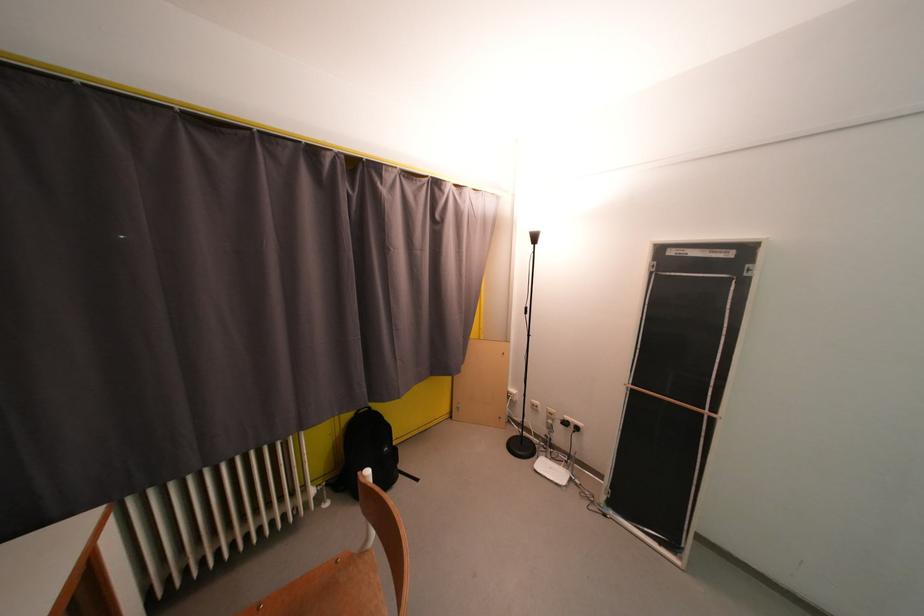
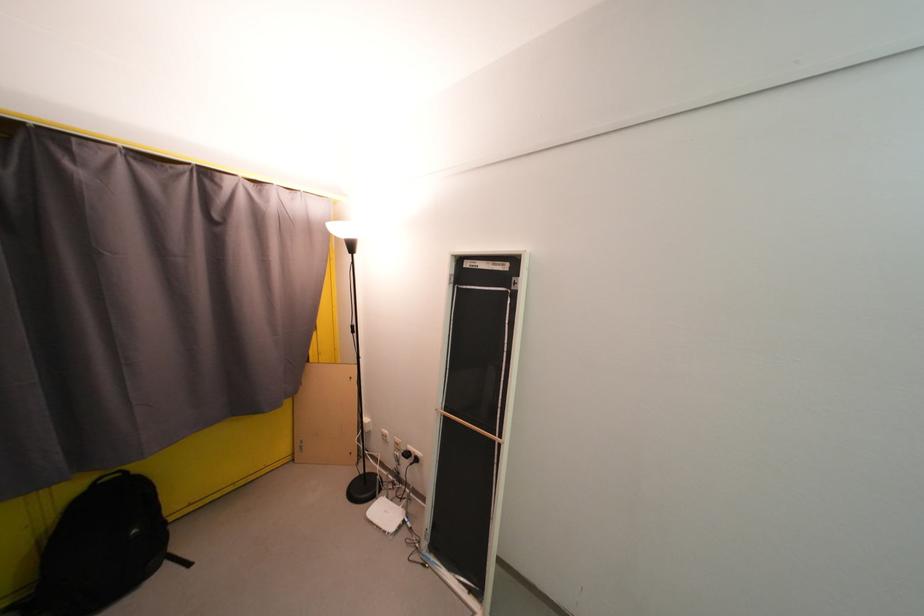
The point at (378, 411) is marked in the first image. Where is the corresponding point in the second image?

(134, 476)